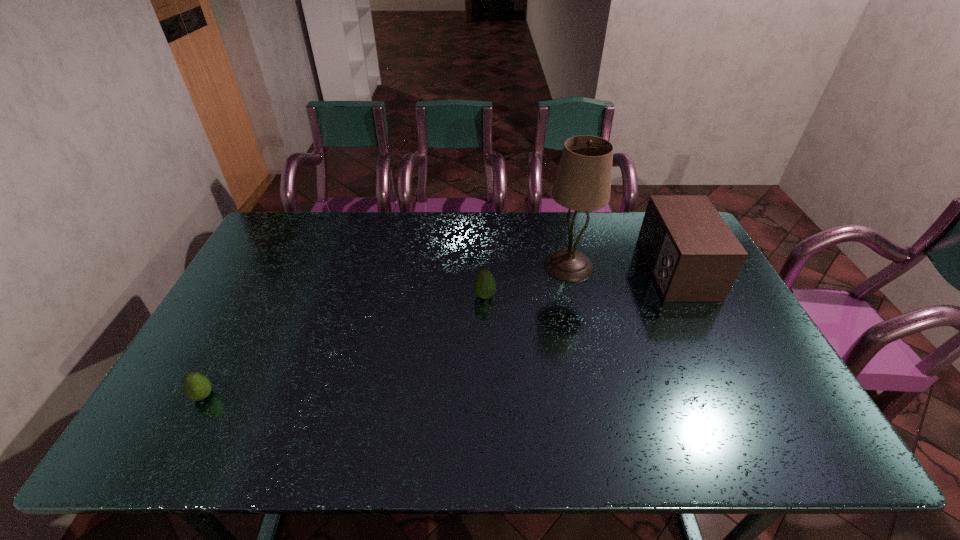
You are a GUI agent. You are given a task and a screenshot of the screen. Output one action in this format:
    pyautogui.click(x=<x>, y=<y>)
    Task: Click on the tallest object
    
    Given the screenshot: What is the action you would take?
    pyautogui.click(x=583, y=181)

This screenshot has width=960, height=540. I want to click on the second object from right to left, so click(x=583, y=181).

The width and height of the screenshot is (960, 540). I want to click on the second tallest object, so click(693, 255).

This screenshot has height=540, width=960. What are the coordinates of `radio receiver` in the screenshot? It's located at (x=693, y=255).

Locate an element on the screen. the second shortest object is located at coordinates (484, 284).

Identify the location of the farther avocado. The width and height of the screenshot is (960, 540). (484, 284).

At what (x,y) coordinates should I click in order to perform the action: click on the nearest object. Please return your answer as a coordinate pair (x, y). The height and width of the screenshot is (540, 960). Looking at the image, I should click on (196, 386).

Image resolution: width=960 pixels, height=540 pixels. I want to click on the shorter avocado, so click(x=196, y=386).

At what (x,y) coordinates should I click in order to perform the action: click on free space located 0.080m on the front-facing side of the tallest object. Please return your answer as a coordinate pair (x, y). Image resolution: width=960 pixels, height=540 pixels. Looking at the image, I should click on (577, 301).

Locate an element on the screen. The image size is (960, 540). vacant point located on the front-facing side of the second tallest object is located at coordinates (518, 269).